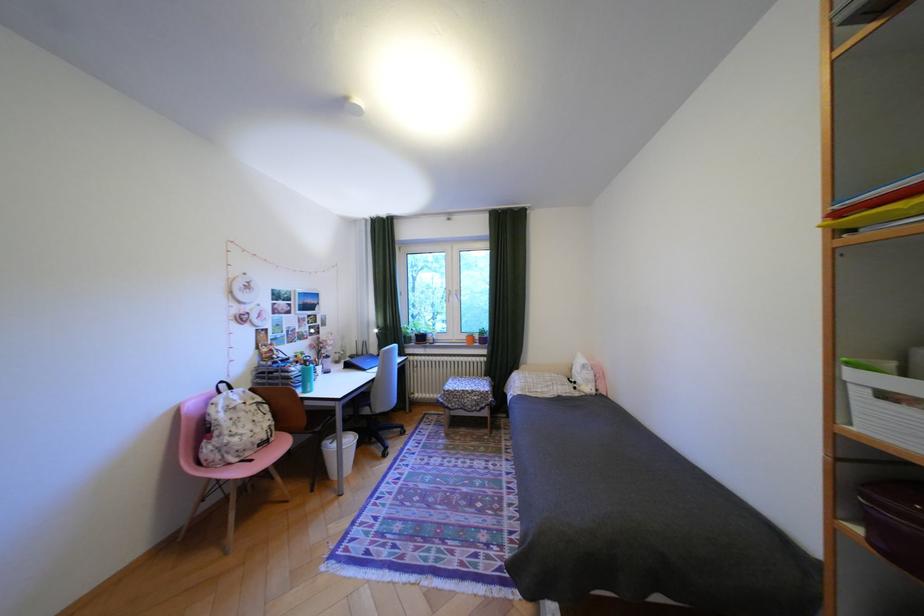
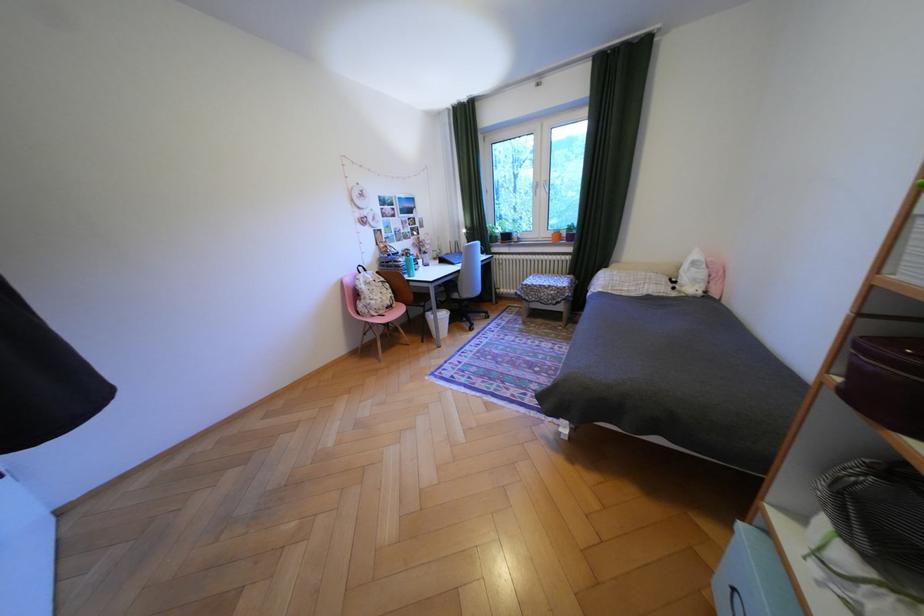
In the second image, find the point that corresponds to [463,297] in the first image.

(551, 190)